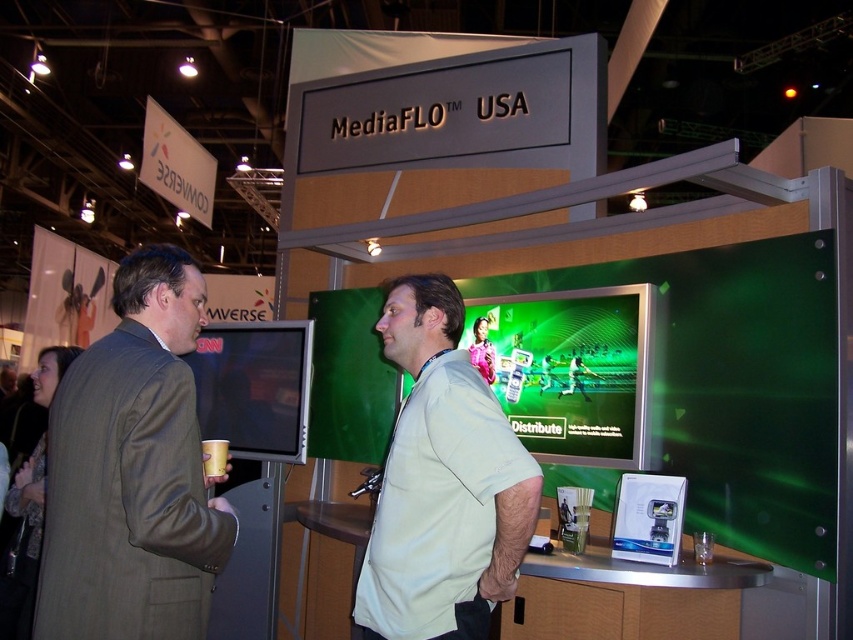
Does point (428, 497) come farther from viewer compared to point (508, 396)?

No, it is in front of (508, 396).

Does light beige shirt at center appear over green glossy screen at center?

Actually, light beige shirt at center is below green glossy screen at center.

Does point (422, 413) lie behind point (605, 388)?

That is False.

Locate an element on the screen. light beige shirt at center is located at coordinates [442, 483].

Between matte brown suit at left and green glossy screen at center, which one has more height?

With more height is matte brown suit at left.

Is point (51, 417) in front of point (633, 288)?

Yes.

This screenshot has height=640, width=853. I want to click on matte brown suit at left, so click(x=132, y=472).

Which of these two, green glossy screen at center or matte black monitor at center, stands shorter?

Standing shorter between the two is matte black monitor at center.

Between green glossy screen at center and matte black monitor at center, which one appears on the right side from the viewer's perspective?

green glossy screen at center

This screenshot has height=640, width=853. Describe the element at coordinates (570, 371) in the screenshot. I see `green glossy screen at center` at that location.

Where is `green glossy screen at center`? green glossy screen at center is located at coordinates (570, 371).